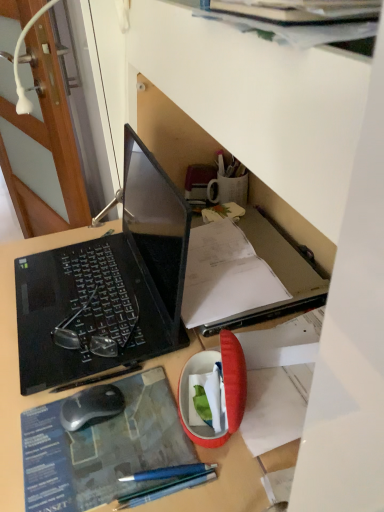
At what (x,y) coordinates should I click in order to perform the action: click on unoccupied region to the right of silver matte computer mouse at lower left. Please return your answer as a coordinate pair (x, y). Image resolution: width=384 pixels, height=512 pixels. Looking at the image, I should click on (147, 414).